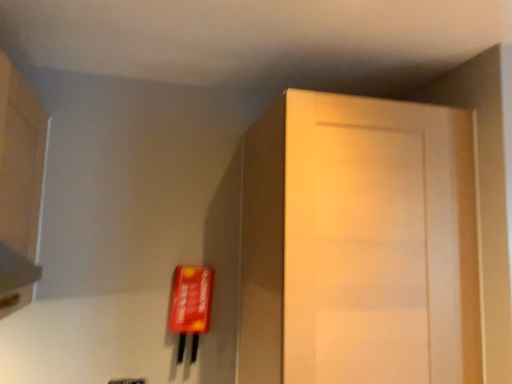
Question: Does matte wood cabinet at upper left lie behind matte wood door at right?

Choices:
 (A) yes
 (B) no

Answer: (B)

Question: Is matte wood cabinet at upper left oriented away from matte wood door at right?

Choices:
 (A) no
 (B) yes

Answer: (A)

Question: From a real-world perspective, is matte wood cabinet at upper left located beneath matte wood door at right?

Choices:
 (A) yes
 (B) no

Answer: (B)

Question: Is matte wood cabinet at upper left at the left side of matte wood door at right?

Choices:
 (A) yes
 (B) no

Answer: (A)

Question: Can you confirm if matte wood cabinet at upper left is positioned to the right of matte wood door at right?

Choices:
 (A) yes
 (B) no

Answer: (B)

Question: Is matte wood cabinet at upper left outside of matte wood door at right?

Choices:
 (A) no
 (B) yes

Answer: (B)

Question: Is matte wood door at right far away from matte wood cabinet at upper left?

Choices:
 (A) yes
 (B) no

Answer: (A)

Question: Is matte wood door at right smaller than matte wood cabinet at upper left?

Choices:
 (A) no
 (B) yes

Answer: (A)

Question: Does matte wood door at right have a lesser height compared to matte wood cabinet at upper left?

Choices:
 (A) yes
 (B) no

Answer: (B)

Question: Is matte wood door at right at the right side of matte wood cabinet at upper left?

Choices:
 (A) no
 (B) yes

Answer: (B)

Question: Considering the relative sizes of matte wood door at right and matte wood cabinet at upper left in the image provided, is matte wood door at right wider than matte wood cabinet at upper left?

Choices:
 (A) no
 (B) yes

Answer: (B)

Question: Considering the relative sizes of matte wood door at right and matte wood cabinet at upper left in the image provided, is matte wood door at right bigger than matte wood cabinet at upper left?

Choices:
 (A) yes
 (B) no

Answer: (A)

Question: From their relative heights in the image, would you say matte wood cabinet at upper left is taller or shorter than matte wood door at right?

Choices:
 (A) tall
 (B) short

Answer: (B)